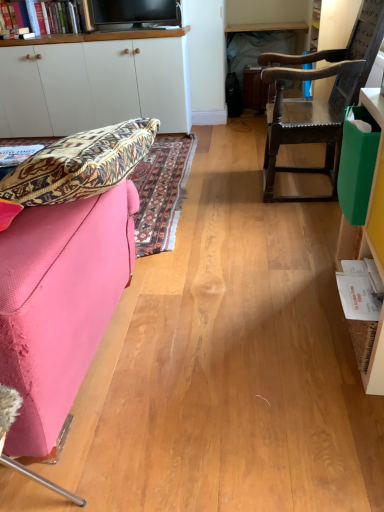
The image size is (384, 512). Find the location of `vacant region to the left of dark brown wooden chair at right`. vacant region to the left of dark brown wooden chair at right is located at coordinates (232, 188).